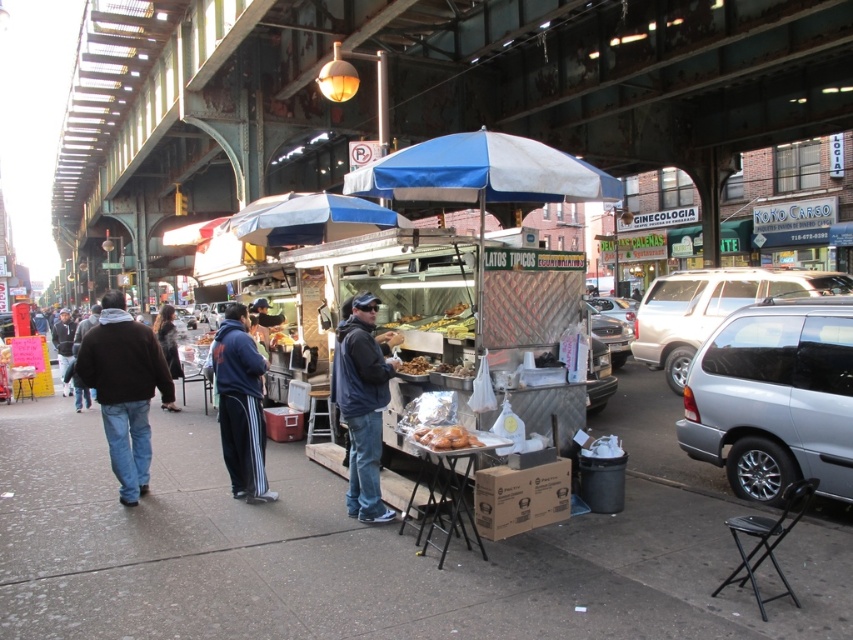
Question: Based on their relative distances, which object is farther from the concrete sidewalk at center?

Choices:
 (A) metallic silver sedan at center
 (B) blue fabric umbrella at center

Answer: (A)

Question: Which is nearer to the golden crispy chicken at center?

Choices:
 (A) concrete sidewalk at center
 (B) dark blue jacket at center

Answer: (B)

Question: Considering the real-world distances, which object is closest to the silver metallic suv at right?

Choices:
 (A) silver metallic minivan at right
 (B) metallic silver sedan at center
 (C) metallic silver car at center
 (D) golden crispy chicken at center

Answer: (B)

Question: Is concrete sidewalk at center to the left of golden crispy chicken at center from the viewer's perspective?

Choices:
 (A) no
 (B) yes

Answer: (B)

Question: Is brown cotton jacket at left wider than blue fabric umbrella at center?

Choices:
 (A) yes
 (B) no

Answer: (A)

Question: Does dark blue jacket at center appear on the right side of brown crispy chicken at center?

Choices:
 (A) yes
 (B) no

Answer: (B)